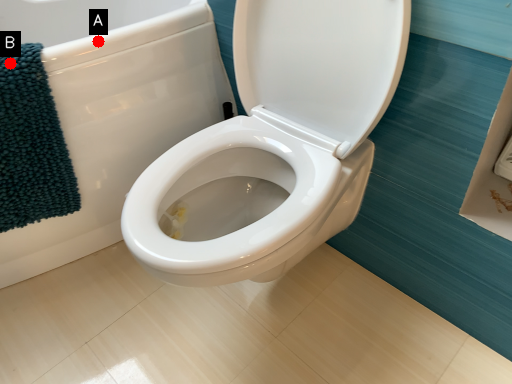
Question: Two points are circled on the image, labeled by A and B beside each circle. Which point is closer to the camera taking this photo?

Choices:
 (A) A is closer
 (B) B is closer

Answer: (B)